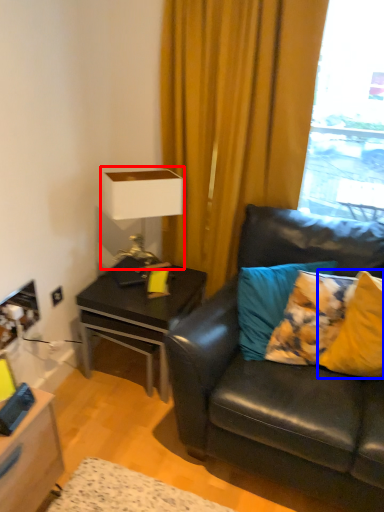
Question: Which of the following is the closest to the observer, table lamp (highlighted by a red box) or pillow (highlighted by a blue box)?

Choices:
 (A) table lamp
 (B) pillow

Answer: (B)